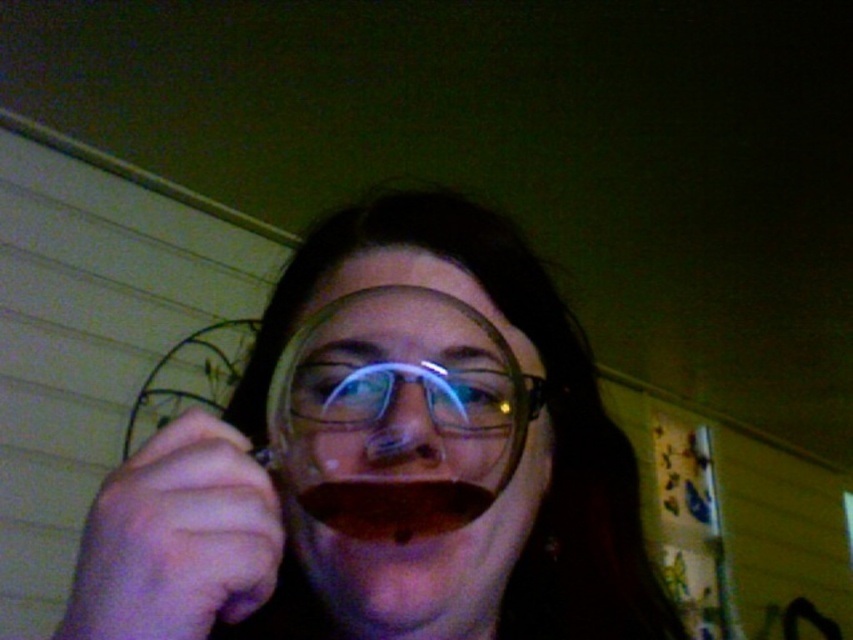
Does transparent plastic wine glass at center come in front of dark red liquid at mouth?

That is False.

Is transparent plastic wine glass at center taller than dark red liquid at mouth?

Indeed, transparent plastic wine glass at center has a greater height compared to dark red liquid at mouth.

This screenshot has width=853, height=640. Identify the location of transparent plastic wine glass at center. (396, 413).

The width and height of the screenshot is (853, 640). What are the coordinates of `transparent plastic wine glass at center` in the screenshot? It's located at (396, 413).

Looking at this image, who is positioned more to the left, matte plastic cup at center or dark red liquid at mouth?

From the viewer's perspective, dark red liquid at mouth appears more on the left side.

Between matte plastic cup at center and dark red liquid at mouth, which one is positioned lower?

dark red liquid at mouth

Is point (97, 577) closer to camera compared to point (387, 540)?

Yes.

The image size is (853, 640). In order to click on matte plastic cup at center in this screenshot , I will do `click(386, 460)`.

From the picture: Can you confirm if clear plastic glasses at center is thinner than dark red liquid at mouth?

No, clear plastic glasses at center is not thinner than dark red liquid at mouth.

Looking at this image, can you confirm if clear plastic glasses at center is shorter than dark red liquid at mouth?

No, clear plastic glasses at center is not shorter than dark red liquid at mouth.

The width and height of the screenshot is (853, 640). Find the location of `clear plastic glasses at center`. clear plastic glasses at center is located at coordinates (421, 392).